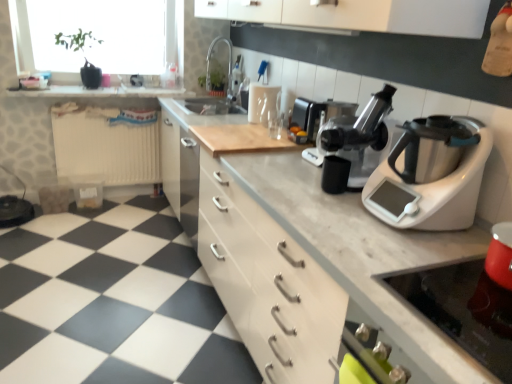
Locate an element on the screen. The height and width of the screenshot is (384, 512). free space above metallic silver gas stove at lower right (from a real-world perspective) is located at coordinates [x=463, y=295].